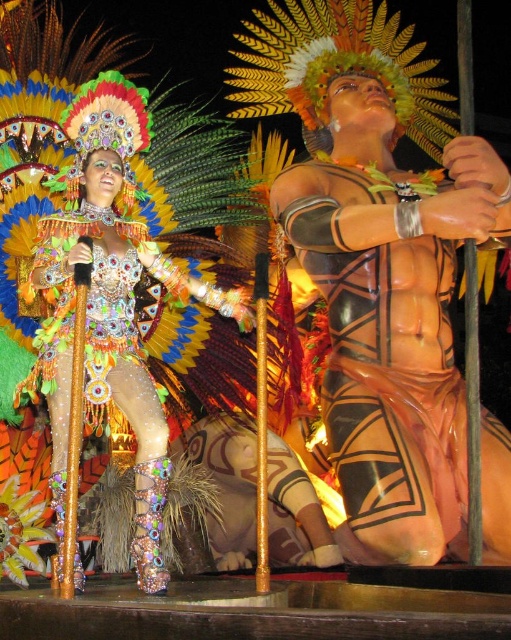
You are a stage manager preparing for a performance. You need to place a decorative prop at the exact center of the stage. However, there is already a matte orange body paint at center located at coordinates point 0.570, 0.751. Is the prop placement at the exact center of the stage feasible?

The exact center of the stage is at point (255, 320). The matte orange body paint at center is located at point (383, 364), which is offset from the true center. Therefore, placing the prop at the exact center is feasible as long as it does not overlap with the existing body paint.

You are a photographer positioned at the back of the stage. You need to capture a photo that includes both the matte orange body paint at center and the shiny sequined dress at center. Since the stage is narrow, you want to know if the two objects can fit side by side in your camera frame. Can they?

The matte orange body paint at center has a lesser width compared to shiny sequined dress at center. However, without knowing the total width of the stage or the camera frame, it is impossible to determine if they can fit side by side. Additional measurements are needed.

You are a photographer at the back of the stage. You need to capture a photo where both the matte orange body paint at center and the shiny sequined dress at center are visible. Based on their positions, which object should you ensure is closer to the left side of your camera frame?

The shiny sequined dress at center should be positioned closer to the left side of the camera frame because the matte orange body paint at center is to the right of it.